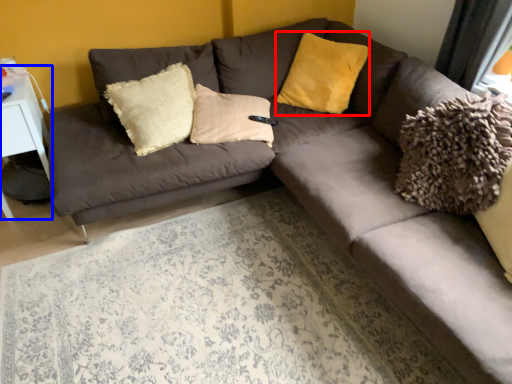
Question: Among these objects, which one is nearest to the camera, pillow (highlighted by a red box) or table (highlighted by a blue box)?

Choices:
 (A) pillow
 (B) table

Answer: (B)